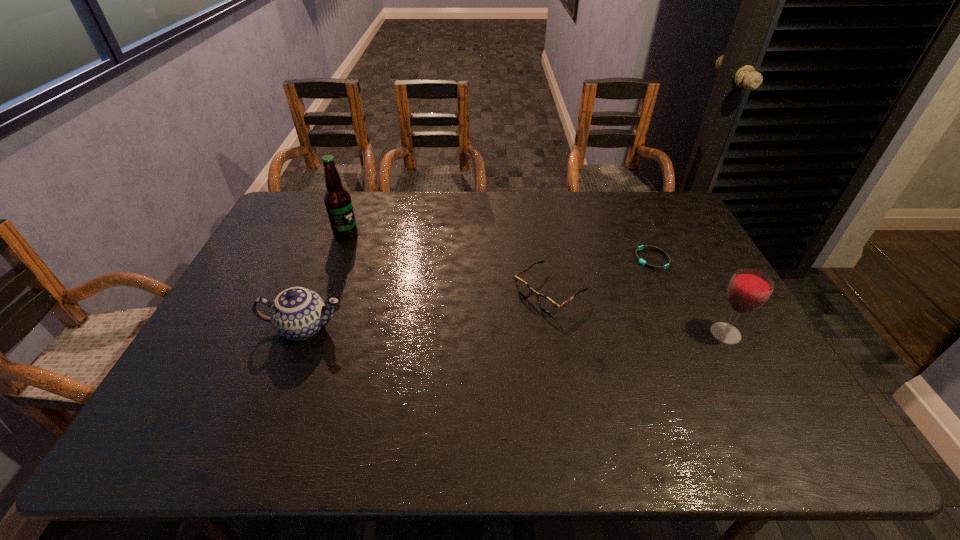
You are a GUI agent. You are given a task and a screenshot of the screen. Output one action in this format:
    pyautogui.click(x=<x>, y=<y>)
    Task: Click on the vacant space on the desktop that is between the third tallest object and the rightmost object and is positioned on the buckle of the wristband
    Image resolution: width=960 pixels, height=540 pixels.
    Given the screenshot: What is the action you would take?
    click(x=553, y=331)

Locate an element on the screen. vacant spot on the desktop that is between the chinaware and the fourth shortest object and is positioned on the frame of the third object from left to right is located at coordinates point(495,330).

Locate an element on the screen. This screenshot has width=960, height=540. vacant space on the desktop that is between the third shortest object and the rightmost object and is positioned on the label of the beer bottle is located at coordinates (477, 330).